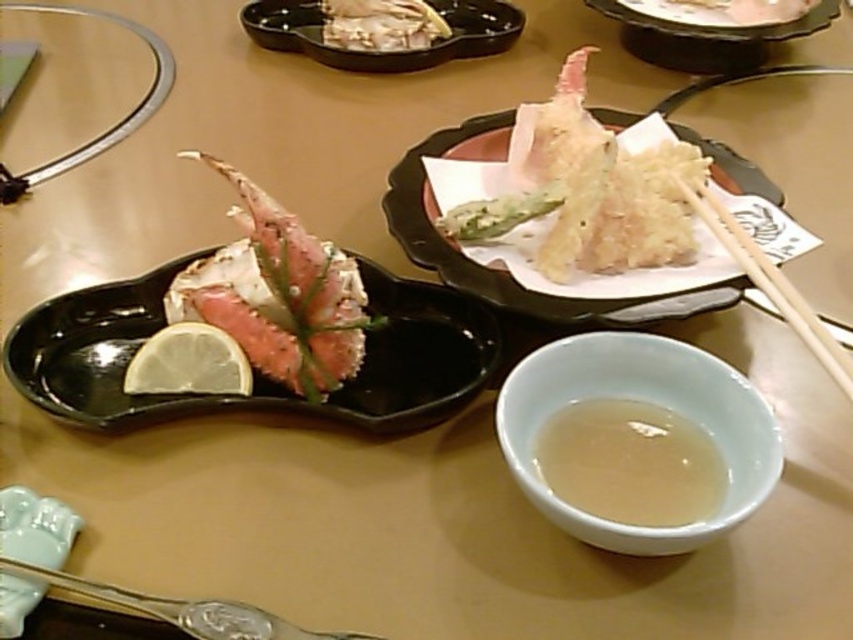
Question: Does brushed metal fork at lower left have a larger size compared to white wood chopsticks at right?

Choices:
 (A) yes
 (B) no

Answer: (B)

Question: Which object appears farthest from the camera in this image?

Choices:
 (A) translucent liquid at center
 (B) shiny silver crab claw at center
 (C) white paper plate at center
 (D) black glossy plate at center left

Answer: (B)

Question: Considering the relative positions of black glossy plate at upper center and white crispy tempura at upper center in the image provided, where is black glossy plate at upper center located with respect to white crispy tempura at upper center?

Choices:
 (A) right
 (B) left

Answer: (B)

Question: Which point is farther to the camera?

Choices:
 (A) (508, 275)
 (B) (358, 353)
 (C) (190, 404)
 (D) (299, 42)

Answer: (D)

Question: Does pink spiny crab at center appear over white crispy tempura at upper center?

Choices:
 (A) yes
 (B) no

Answer: (B)

Question: Among these points, which one is farthest from the camera?

Choices:
 (A) (645, 262)
 (B) (318, 51)

Answer: (B)